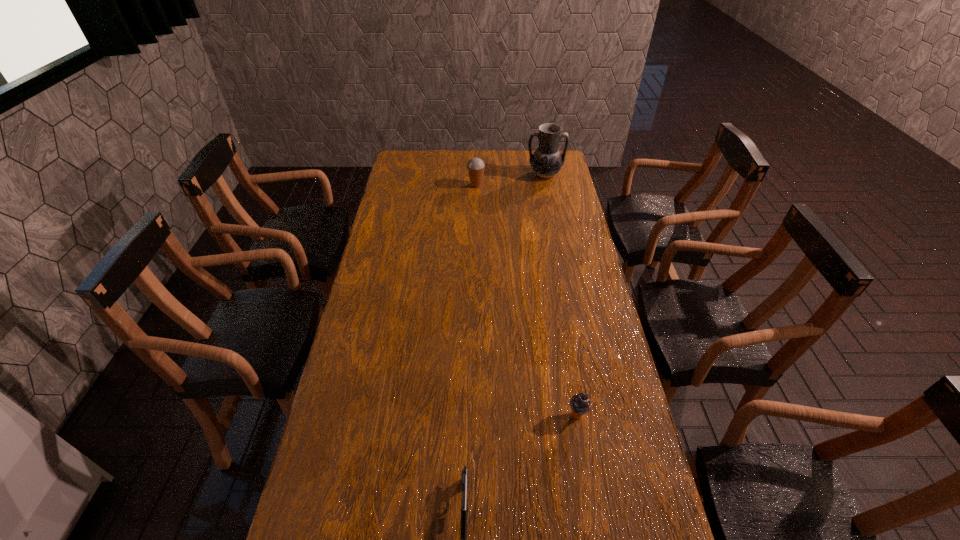
The height and width of the screenshot is (540, 960). I want to click on icecream present at the right edge, so click(580, 404).

Locate an element on the screen. The width and height of the screenshot is (960, 540). object that is positioned at the far right corner is located at coordinates (546, 162).

This screenshot has width=960, height=540. In the image, there is a desktop. Identify the location of free space at the far edge. (488, 158).

Where is `vacant region at the left edge of the desktop`? Image resolution: width=960 pixels, height=540 pixels. vacant region at the left edge of the desktop is located at coordinates (356, 320).

Find the location of a particular element. This screenshot has width=960, height=540. vacant space at the right edge of the desktop is located at coordinates (627, 509).

What are the coordinates of `free space at the far left corner of the desktop` in the screenshot? It's located at (398, 159).

The height and width of the screenshot is (540, 960). Find the location of `vacant area between the pitcher and the third farthest object`. vacant area between the pitcher and the third farthest object is located at coordinates (561, 295).

This screenshot has height=540, width=960. I want to click on free space that is in between the tallest object and the third shortest object, so click(511, 180).

The width and height of the screenshot is (960, 540). I want to click on vacant point located between the tallest object and the second shortest object, so click(561, 295).

This screenshot has height=540, width=960. I want to click on free space between the tallest object and the farther icecream, so click(x=511, y=180).